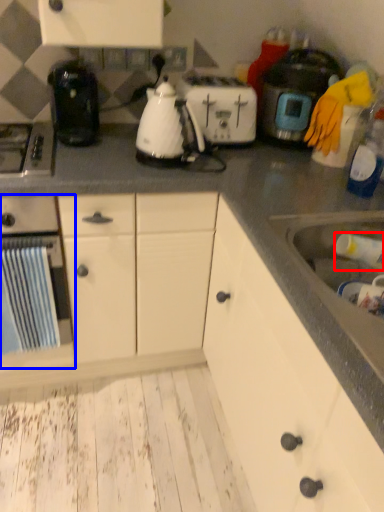
Question: Which object is closer to the camera taking this photo, bottle (highlighted by a red box) or kitchen appliance (highlighted by a blue box)?

Choices:
 (A) bottle
 (B) kitchen appliance

Answer: (A)